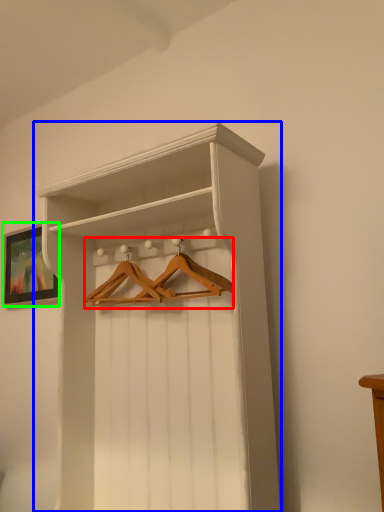
Question: Which is farther away from hanger (highlighted by a red box)? shelf (highlighted by a blue box) or picture frame (highlighted by a green box)?

Choices:
 (A) shelf
 (B) picture frame

Answer: (B)